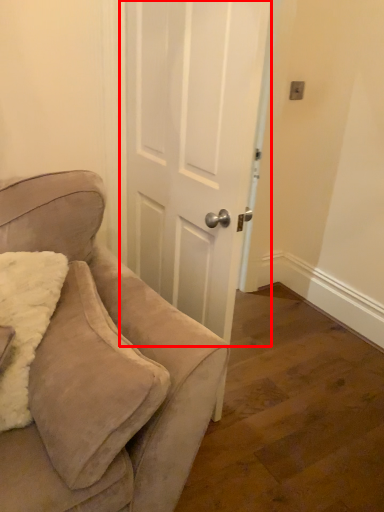
Question: From the image's perspective, where is door (annotated by the red box) located relative to chair?

Choices:
 (A) below
 (B) above

Answer: (B)